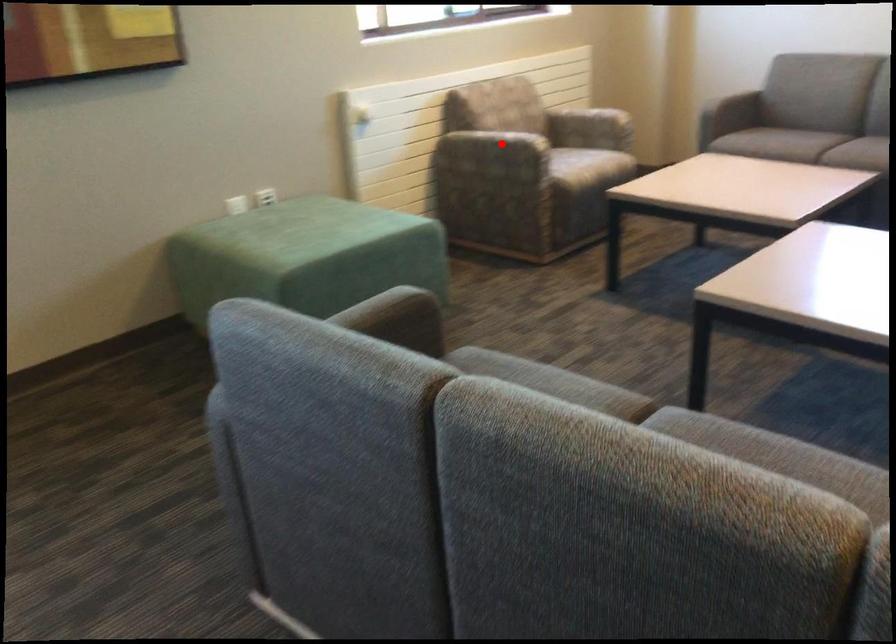
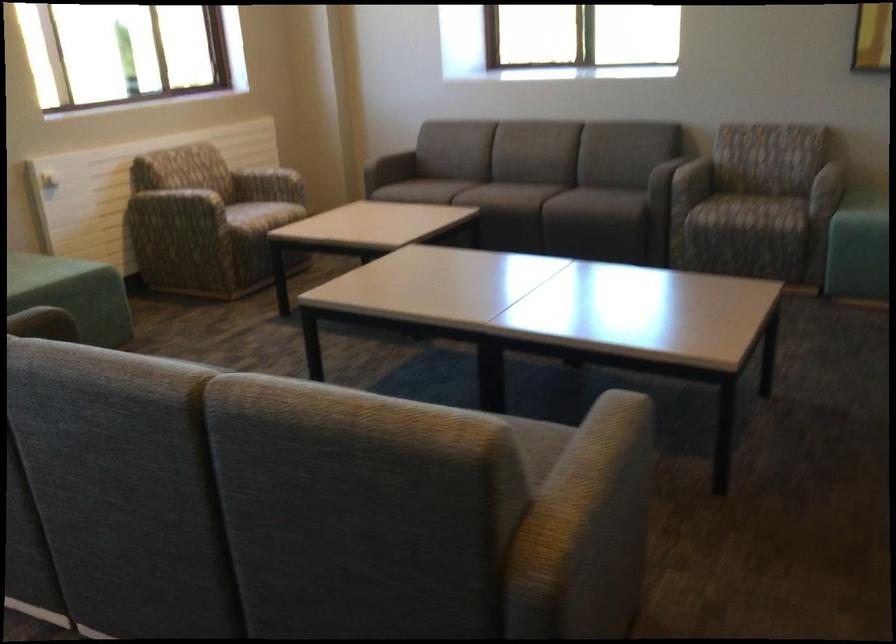
Locate, in the second image, the point that corresponds to the highlighted location in the first image.

(179, 204)